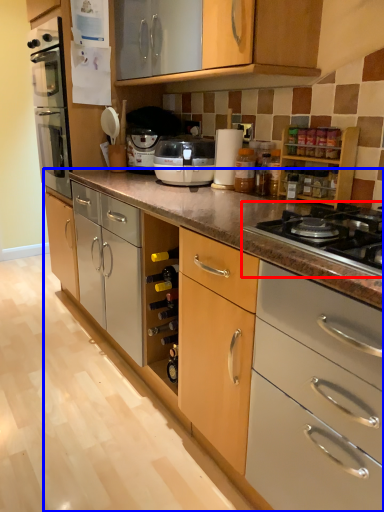
Question: Among these objects, which one is farthest to the camera, gas stove (highlighted by a red box) or cabinetry (highlighted by a blue box)?

Choices:
 (A) gas stove
 (B) cabinetry

Answer: (B)